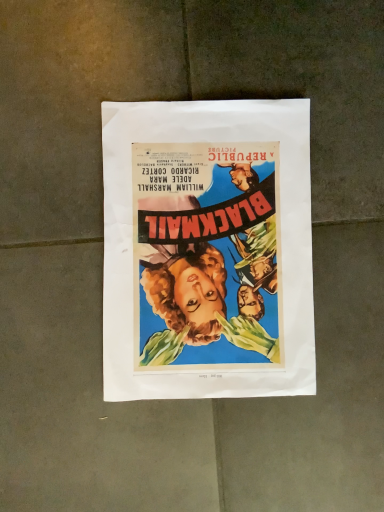
The image size is (384, 512). What do you see at coordinates (207, 250) in the screenshot?
I see `matte paper poster at center` at bounding box center [207, 250].

At what (x,y) coordinates should I click in order to perform the action: click on matte paper poster at center. Please return your answer as a coordinate pair (x, y). Looking at the image, I should click on (207, 250).

In order to face matte paper poster at center, should I rotate leftwards or rightwards?

To face it directly, rotate right by 2.127 degrees.

Locate an element on the screen. Image resolution: width=384 pixels, height=512 pixels. matte paper poster at center is located at coordinates (207, 250).